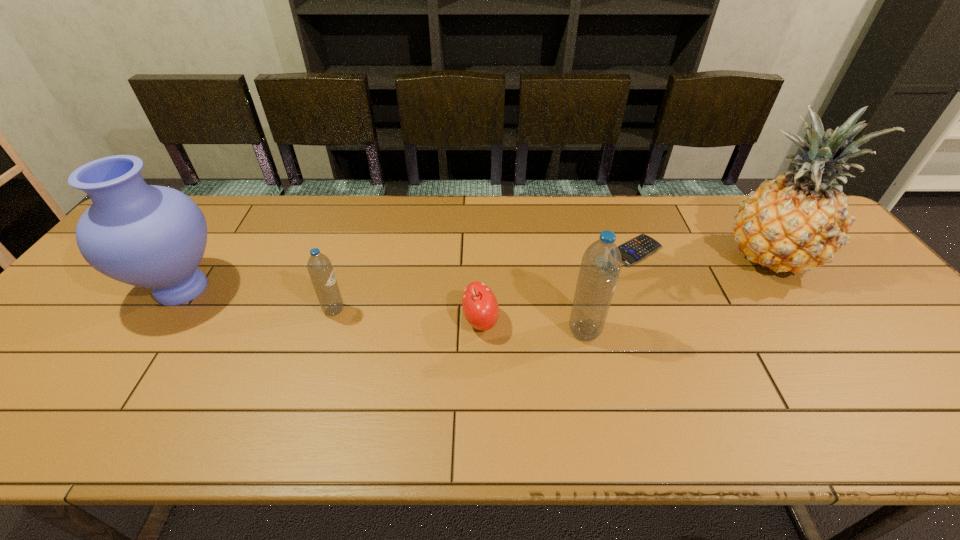
Where is `vacant space in between the pineapple and the right water bottle`? vacant space in between the pineapple and the right water bottle is located at coordinates (676, 294).

Where is `free space between the right water bottle and the pineapple`? Image resolution: width=960 pixels, height=540 pixels. free space between the right water bottle and the pineapple is located at coordinates (676, 294).

At what (x,y) coordinates should I click in order to perform the action: click on vacant area between the nearer water bottle and the fifth tallest object. Please return your answer as a coordinate pair (x, y). The height and width of the screenshot is (540, 960). Looking at the image, I should click on (533, 326).

Locate an element on the screen. The width and height of the screenshot is (960, 540). empty space between the second shortest object and the rightmost object is located at coordinates [624, 289].

Locate an element on the screen. Image resolution: width=960 pixels, height=540 pixels. the fourth closest object to the shortest object is located at coordinates click(320, 269).

This screenshot has width=960, height=540. In order to click on object that is the second nearest to the fifth tallest object in this screenshot , I will do `click(320, 269)`.

Locate an element on the screen. vacant space that satisfies the following two spatial constraints: 1. on the back side of the apple; 2. on the left side of the pineapple is located at coordinates pyautogui.click(x=480, y=256).